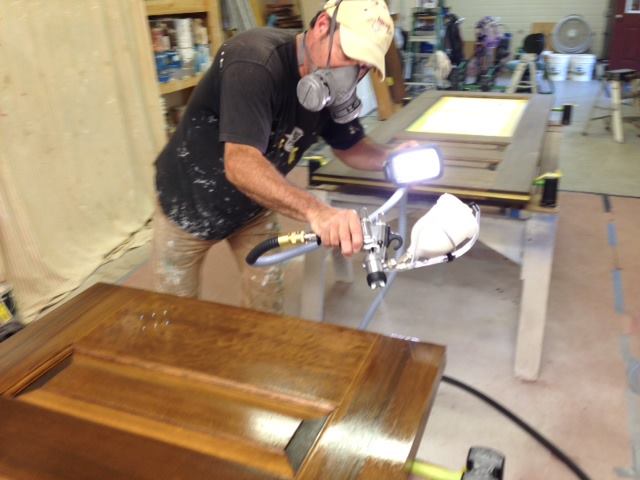
The width and height of the screenshot is (640, 480). What are the coordinates of `curtain` in the screenshot? It's located at (66, 88).